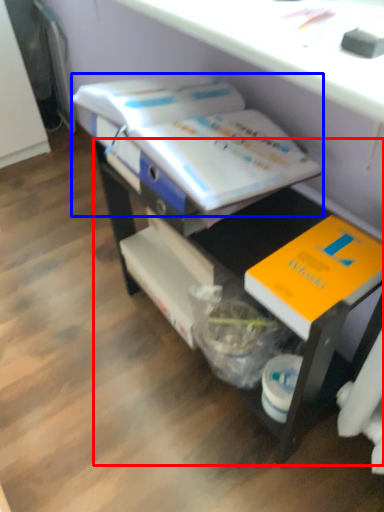
Question: Which point is closer to the camera, desk (highlighted by a red box) or book (highlighted by a blue box)?

Choices:
 (A) desk
 (B) book

Answer: (A)